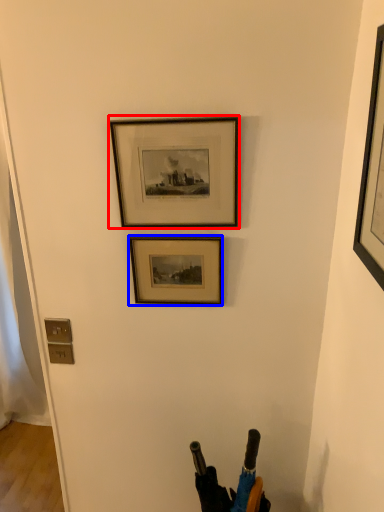
Question: Which point is closer to the camera, picture frame (highlighted by a red box) or picture frame (highlighted by a blue box)?

Choices:
 (A) picture frame
 (B) picture frame

Answer: (A)